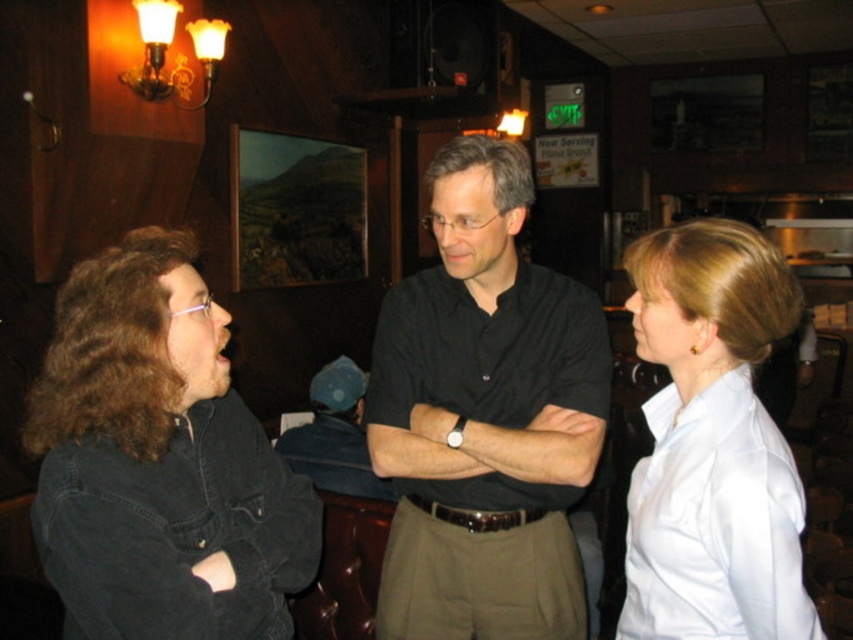
Does denim jacket at lower left appear on the left side of white satin blouse at right?

Correct, you'll find denim jacket at lower left to the left of white satin blouse at right.

Is point (79, 280) more distant than point (703, 300)?

Yes, it is.

The height and width of the screenshot is (640, 853). Find the location of `denim jacket at lower left`. denim jacket at lower left is located at coordinates (160, 461).

Who is higher up, black matte shirt at center or denim jacket at lower left?

black matte shirt at center is higher up.

Can you confirm if black matte shirt at center is thinner than denim jacket at lower left?

Yes, black matte shirt at center is thinner than denim jacket at lower left.

Is point (422, 468) in front of point (263, 561)?

No, it is not.

Locate an element on the screen. The width and height of the screenshot is (853, 640). black matte shirt at center is located at coordinates (485, 417).

Who is more distant from viewer, (538, 396) or (656, 360)?

Positioned behind is point (538, 396).

Image resolution: width=853 pixels, height=640 pixels. Identify the location of black matte shirt at center. (485, 417).